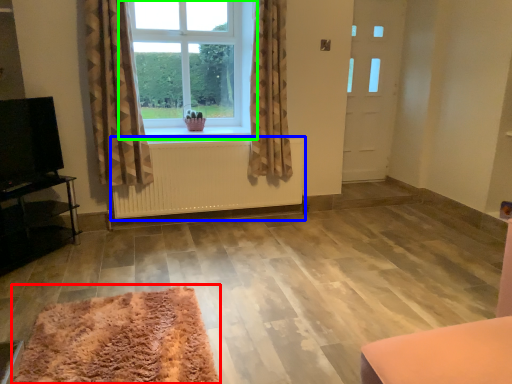
Question: Which object is the closest to the mat (highlighted by a red box)? Choose among these: radiator (highlighted by a blue box) or window (highlighted by a green box).

Choices:
 (A) radiator
 (B) window

Answer: (A)